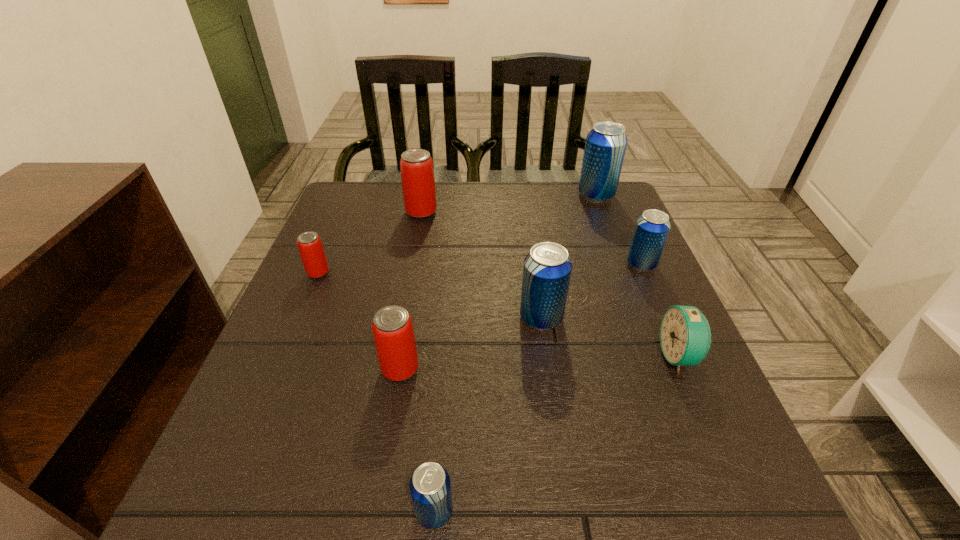
Find the location of a particular element. free spot between the third biggest blue beer can and the farthest pink beer can is located at coordinates (531, 238).

This screenshot has height=540, width=960. Find the location of `vacant area that lies between the leftmost object and the blue alarm clock`. vacant area that lies between the leftmost object and the blue alarm clock is located at coordinates (499, 314).

Identify which object is the fifth nearest to the alarm clock. Please provide its 2D coordinates. Your answer should be formatted as a tuple, i.e. [(x, y)], where the tuple contains the x and y coordinates of a point satisfying the conditions above.

[(606, 143)]

You are a GUI agent. You are given a task and a screenshot of the screen. Output one action in this format:
    pyautogui.click(x=<x>, y=<y>)
    Task: Click on the third closest object relative to the farthest blue beer can
    The image size is (960, 540).
    Given the screenshot: What is the action you would take?
    pyautogui.click(x=547, y=269)

At what (x,y) coordinates should I click in order to perform the action: click on beer can that is the fourth closest one to the alarm clock. Please return your answer as a coordinate pair (x, y). Looking at the image, I should click on (x=392, y=327).

Image resolution: width=960 pixels, height=540 pixels. I want to click on beer can that is the fourth nearest to the sixth farthest beer can, so click(416, 165).

Find the location of a particular element. The width and height of the screenshot is (960, 540). the closest blue beer can relative to the third nearest blue beer can is located at coordinates (547, 269).

Identify which blue beer can is the second closest to the farthest blue beer can. Please provide its 2D coordinates. Your answer should be formatted as a tuple, i.e. [(x, y)], where the tuple contains the x and y coordinates of a point satisfying the conditions above.

[(547, 269)]

Locate which pink beer can is the second closest to the smallest blue beer can. Please provide its 2D coordinates. Your answer should be formatted as a tuple, i.e. [(x, y)], where the tuple contains the x and y coordinates of a point satisfying the conditions above.

[(311, 250)]

Find the location of a particular element. pink beer can that stands as the third closest to the fifth farthest beer can is located at coordinates click(x=311, y=250).